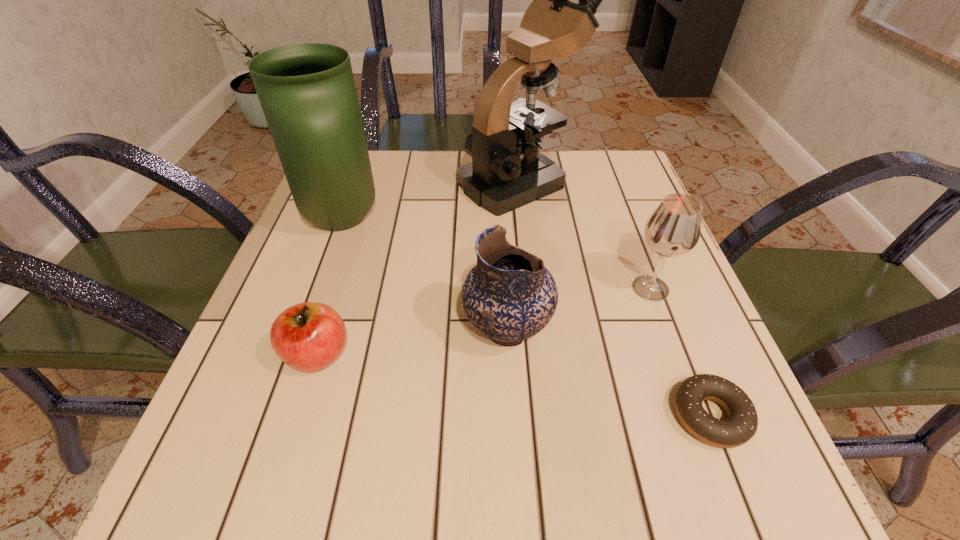
This screenshot has width=960, height=540. What are the coordinates of `blank area located on the back of the pottery` in the screenshot? It's located at pos(505,277).

This screenshot has height=540, width=960. Find the location of `free space located 0.130m on the back of the fifth tallest object`. free space located 0.130m on the back of the fifth tallest object is located at coordinates (342, 276).

Image resolution: width=960 pixels, height=540 pixels. Identify the location of vacant region located on the left of the nearest object. (479, 416).

Image resolution: width=960 pixels, height=540 pixels. I want to click on microscope positioned at the far edge, so click(507, 171).

You are a GUI agent. You are given a task and a screenshot of the screen. Output one action in this format:
    pyautogui.click(x=<x>, y=<y>)
    Task: Click on the vase present at the far edge
    The height and width of the screenshot is (540, 960).
    Given the screenshot: What is the action you would take?
    pyautogui.click(x=307, y=92)

The image size is (960, 540). Identify the location of object situated at the near edge. (741, 425).

This screenshot has height=540, width=960. I want to click on vase that is at the left edge, so click(x=307, y=92).

Where is `apple situated at the left edge`? apple situated at the left edge is located at coordinates (309, 336).

Find the location of `microscope situated at the right edge`. microscope situated at the right edge is located at coordinates (507, 171).

Locate an element on the screen. wineglass positioned at the right edge is located at coordinates (673, 229).